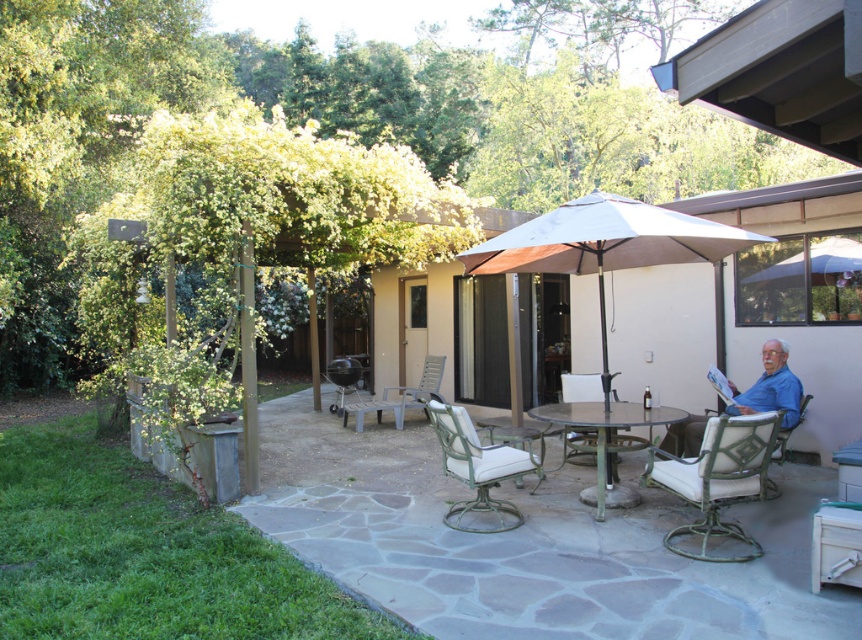
In the scene shown: Can you confirm if green metal chair at center is smaller than black matte grill at center?

Correct, green metal chair at center occupies less space than black matte grill at center.

Does green metal chair at center come in front of black matte grill at center?

Yes, it is in front of black matte grill at center.

This screenshot has width=862, height=640. Identify the location of green metal chair at center. (478, 468).

Between green metal chair at center and metallic green chair at center, which one has less height?

metallic green chair at center

How much distance is there between green metal chair at center and metallic green chair at center?

The distance of green metal chair at center from metallic green chair at center is 2.05 meters.

Between point (454, 513) and point (614, 458), which one is positioned in front?

Positioned in front is point (454, 513).

Image resolution: width=862 pixels, height=640 pixels. Find the location of `green metal chair at center`. green metal chair at center is located at coordinates (x=478, y=468).

Between point (838, 240) and point (694, 554), which one is positioned in front?

Positioned in front is point (694, 554).

Who is higher up, white fabric umbrella at upper right or green metal chair at lower right?

white fabric umbrella at upper right

Who is more distant from viewer, (836, 278) or (754, 460)?

The point (836, 278) is behind.

Locate an element on the screen. white fabric umbrella at upper right is located at coordinates (800, 282).